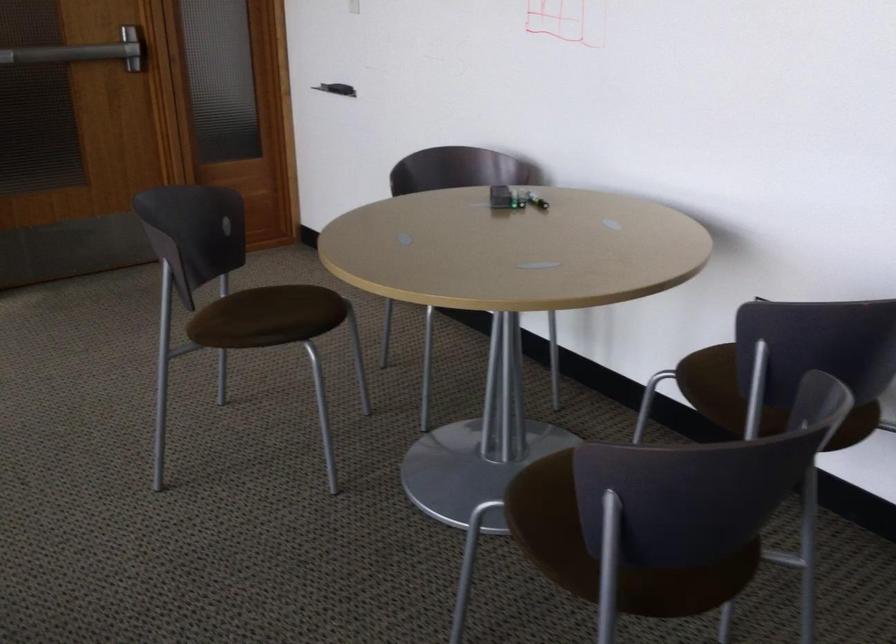
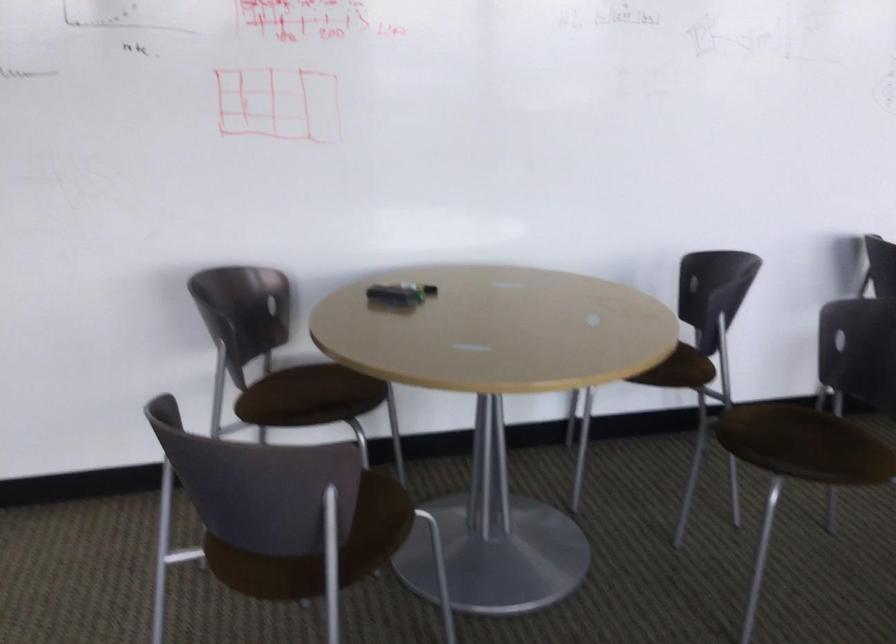
Where in the second image is the point corresponding to the point at 556,207 from the first image?

(433, 290)